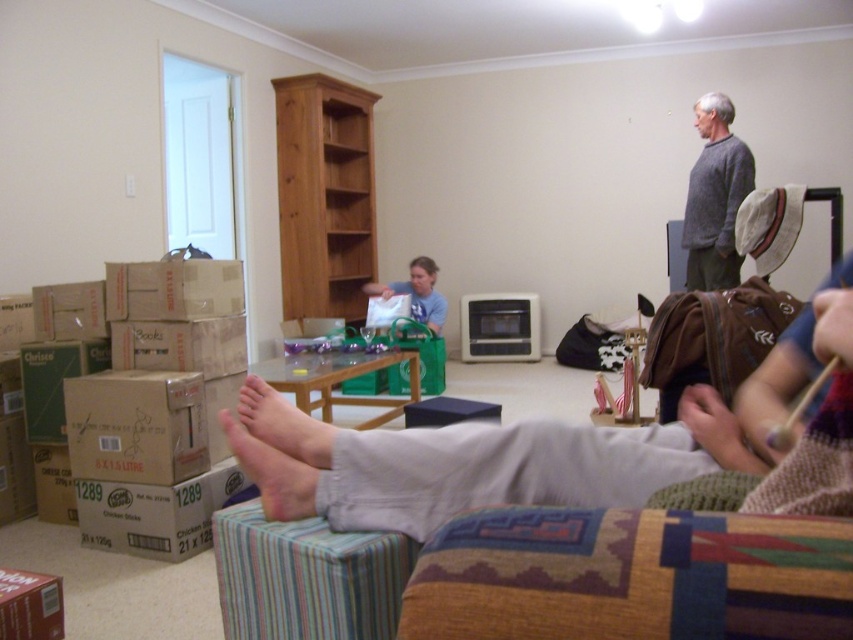
Question: Which of the following is the closest to the observer?

Choices:
 (A) (45, 621)
 (B) (410, 301)
 (C) (306, 529)
 (D) (241, 465)

Answer: (C)

Question: Does gray sweater at upper right appear on the right side of light beige skin at lower center?

Choices:
 (A) yes
 (B) no

Answer: (A)

Question: Which point appears closest to the camera in this image?

Choices:
 (A) (426, 275)
 (B) (711, 289)
 (C) (263, 484)

Answer: (C)

Question: Is smooth skin foot at lower center below light beige skin at lower center?

Choices:
 (A) yes
 (B) no

Answer: (A)

Question: Which object is the farthest from the red cardboard box at lower left?

Choices:
 (A) light beige skin at lower center
 (B) light gray pants at lower center
 (C) brown cardboard box at lower left

Answer: (B)

Question: Is brown cardboard box at lower left wider than light beige skin at lower center?

Choices:
 (A) no
 (B) yes

Answer: (B)